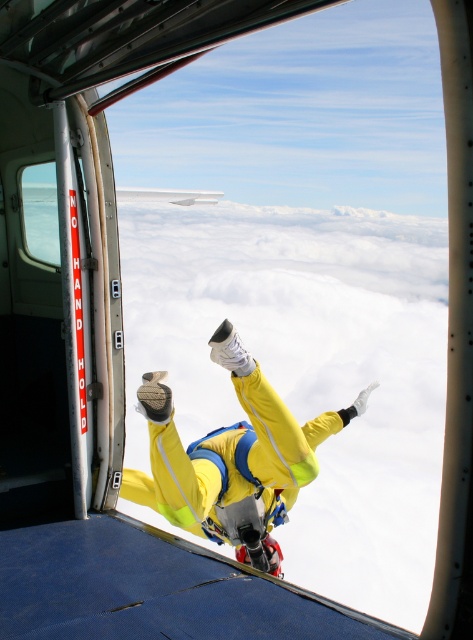
You are a pilot observing the scene from the cockpit. You notice the yellow fabric suit at center and the transparent glass airplane window at left. Which object appears bigger in the view?

The yellow fabric suit at center appears bigger than the transparent glass airplane window at left because it is larger in size.

You are a skydiver preparing to exit the aircraft. You notice the yellow fabric suit at center and the transparent glass airplane window at left. How far apart are these two items?

The yellow fabric suit at center and the transparent glass airplane window at left are 2.46 meters apart.